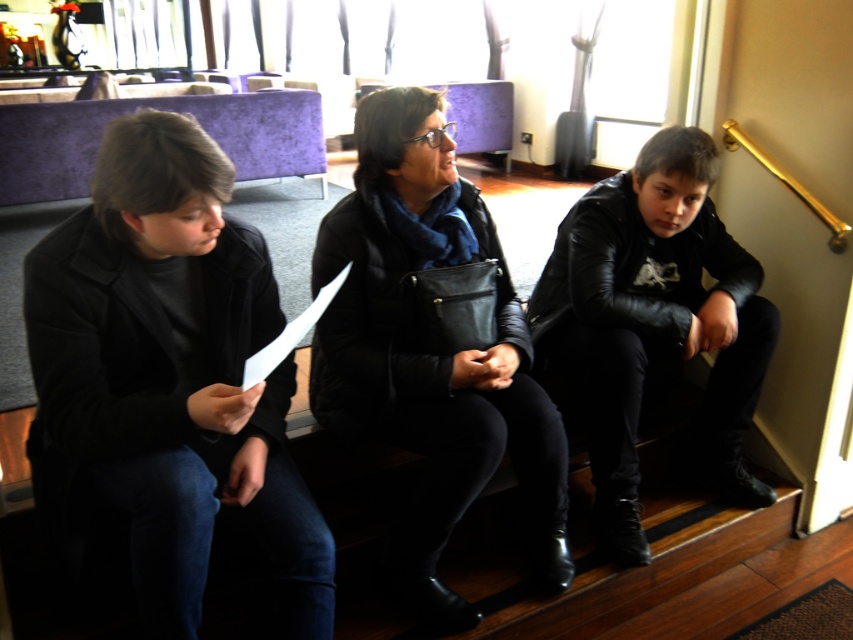
Who is lower down, black matte jacket at center or black leather jacket at right?

Positioned lower is black matte jacket at center.

You are a GUI agent. You are given a task and a screenshot of the screen. Output one action in this format:
    pyautogui.click(x=<x>, y=<y>)
    Task: Click on the black matte jacket at center
    
    Given the screenshot: What is the action you would take?
    pyautogui.click(x=433, y=346)

Identify the location of black matte jacket at center. The width and height of the screenshot is (853, 640). (433, 346).